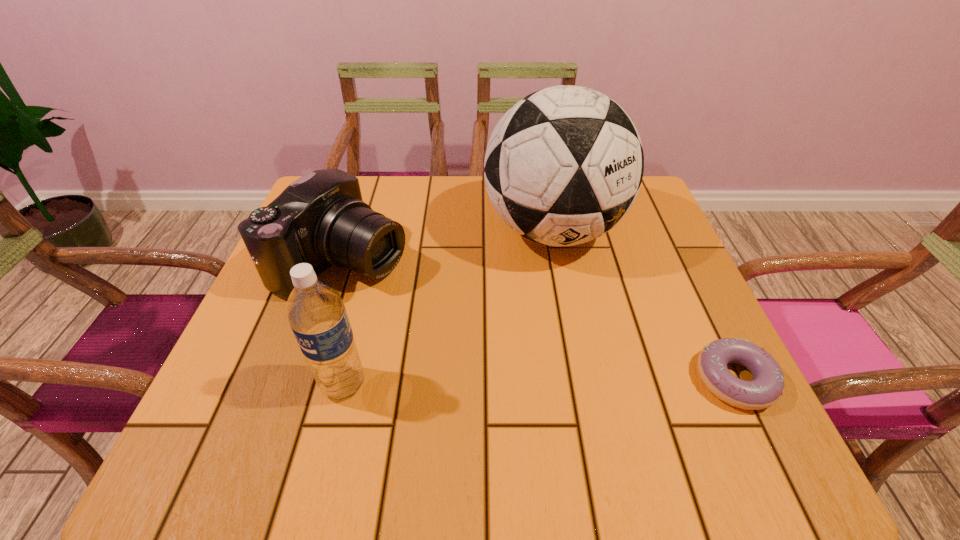
Image resolution: width=960 pixels, height=540 pixels. I want to click on water bottle, so [x=317, y=315].

Where is `the rightmost object`? This screenshot has width=960, height=540. the rightmost object is located at coordinates (766, 388).

You are a GUI agent. You are given a task and a screenshot of the screen. Output one action in this format:
    pyautogui.click(x=<x>, y=<y>)
    Task: Click on the shortest object
    This screenshot has height=540, width=960.
    Given the screenshot: What is the action you would take?
    pyautogui.click(x=766, y=388)

Image resolution: width=960 pixels, height=540 pixels. Find the location of `the third tallest object`. the third tallest object is located at coordinates (321, 219).

The image size is (960, 540). Identify the location of the second object from right to left. (564, 165).

This screenshot has width=960, height=540. In order to click on soccer ball in this screenshot , I will do `click(564, 165)`.

Where is `vacant space situated on the back of the water bottle`? The height and width of the screenshot is (540, 960). vacant space situated on the back of the water bottle is located at coordinates (370, 281).

At what (x,y) coordinates should I click in order to perform the action: click on vacant space positioned on the left of the rightmost object. Please return your answer as a coordinate pair (x, y). This screenshot has width=960, height=540. Looking at the image, I should click on (595, 380).

Locate an element on the screen. vacant space located on the lens of the second shortest object is located at coordinates (564, 365).

The height and width of the screenshot is (540, 960). Find the location of `vacant space located 0.180m on the lens of the second shortest object`. vacant space located 0.180m on the lens of the second shortest object is located at coordinates (464, 316).